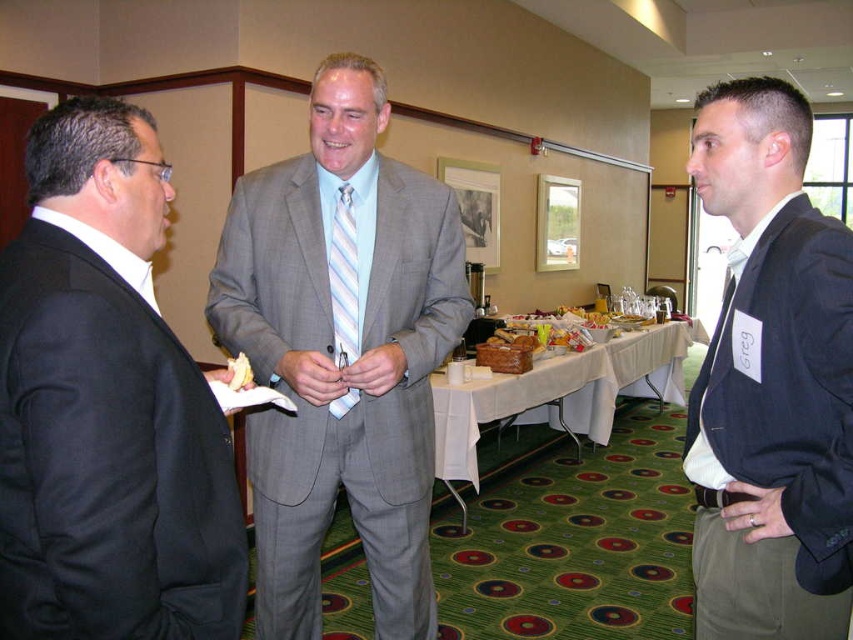
Question: Does gray textured suit at center have a greater width compared to dark blue suit at right?

Choices:
 (A) no
 (B) yes

Answer: (B)

Question: In this image, where is black matte suit at left located relative to white cloth table at center?

Choices:
 (A) left
 (B) right

Answer: (A)

Question: Which object appears farthest from the camera in this image?

Choices:
 (A) white cloth table at center
 (B) yellow bread at center

Answer: (A)

Question: Observing the image, what is the correct spatial positioning of gray textured suit at center in reference to yellow bread at center?

Choices:
 (A) right
 (B) left

Answer: (A)

Question: Which point is closer to the camera?

Choices:
 (A) (180, 611)
 (B) (695, 145)
 (C) (238, 387)
 (D) (596, 436)

Answer: (A)

Question: Which object is the farthest from the yellow bread at center?

Choices:
 (A) black matte suit at left
 (B) dark blue suit at right
 (C) white cloth table at center

Answer: (C)